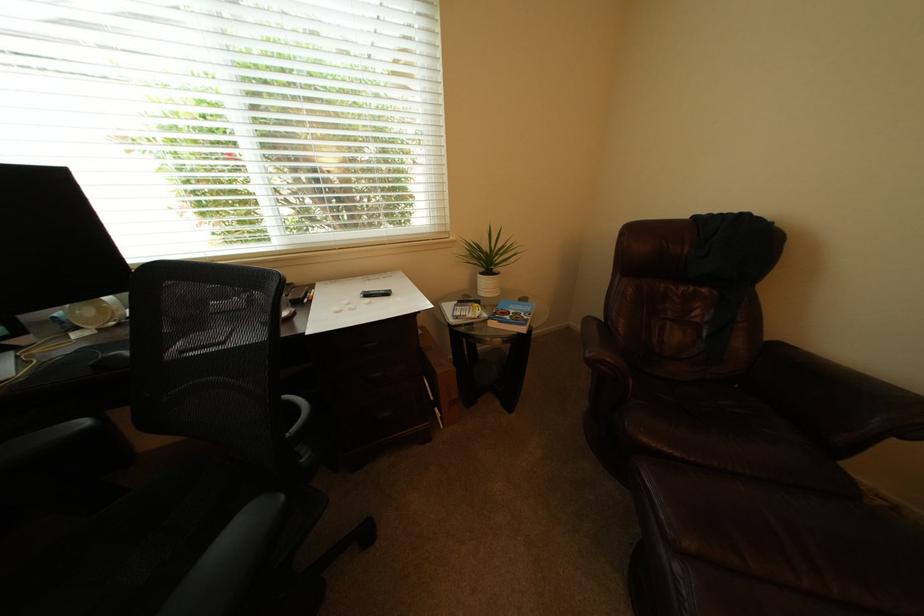
Where would you sit the chair sitting surface? Please return your answer as a coordinate pair (x, y).

(136, 525)